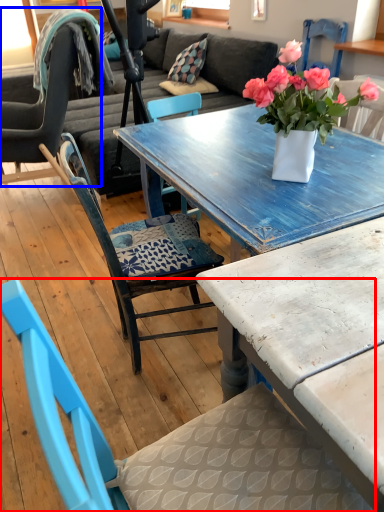
Question: Which object appears farthest to the camera in this image, chair (highlighted by a red box) or chair (highlighted by a blue box)?

Choices:
 (A) chair
 (B) chair

Answer: (B)